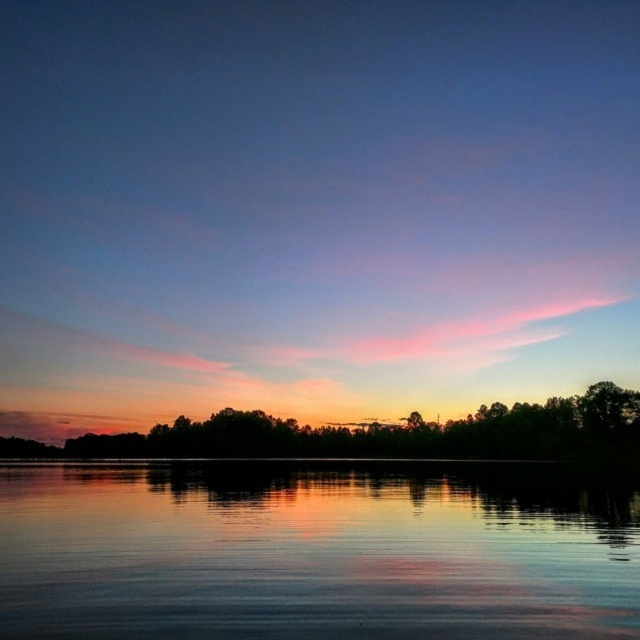
Question: Which object appears farthest from the camera in this image?

Choices:
 (A) green matte trees at center
 (B) smooth reflective water at center

Answer: (A)

Question: Is smooth reflective water at center below green matte trees at center?

Choices:
 (A) yes
 (B) no

Answer: (B)

Question: Which point appears farthest from the camera in this image?

Choices:
 (A) (451, 605)
 (B) (292, 451)

Answer: (B)

Question: Is smooth reflective water at center thinner than green matte trees at center?

Choices:
 (A) no
 (B) yes

Answer: (B)

Question: Is smooth reflective water at center positioned at the back of green matte trees at center?

Choices:
 (A) yes
 (B) no

Answer: (B)

Question: Which of the following is the closest to the observer?

Choices:
 (A) smooth reflective water at center
 (B) green matte trees at center

Answer: (A)